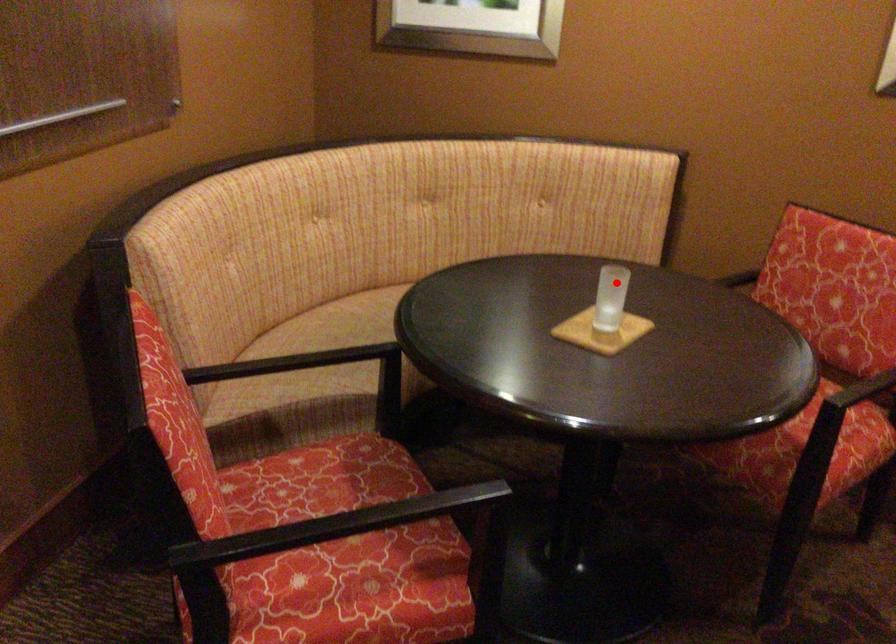
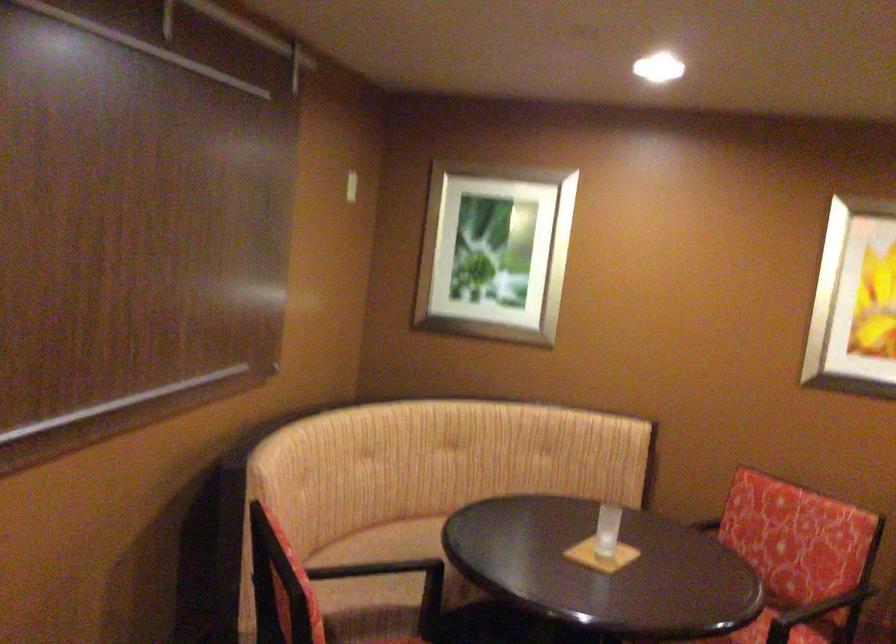
Question: I am providing you with two images of the same scene from different viewpoints. In image1, a red point is highlighted. Considering the same 3D point in image2, which of the following is correct?

Choices:
 (A) It is closer
 (B) It is farther

Answer: (B)